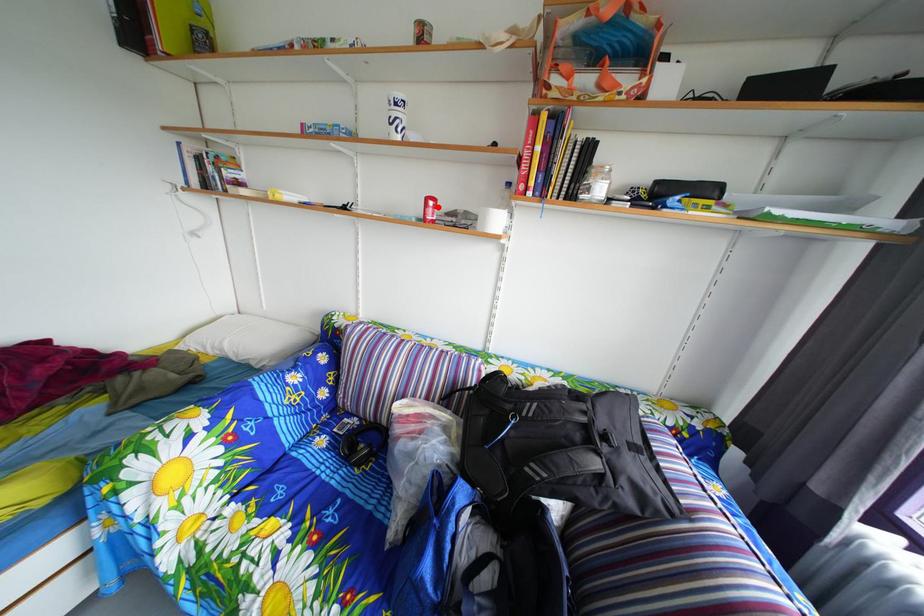
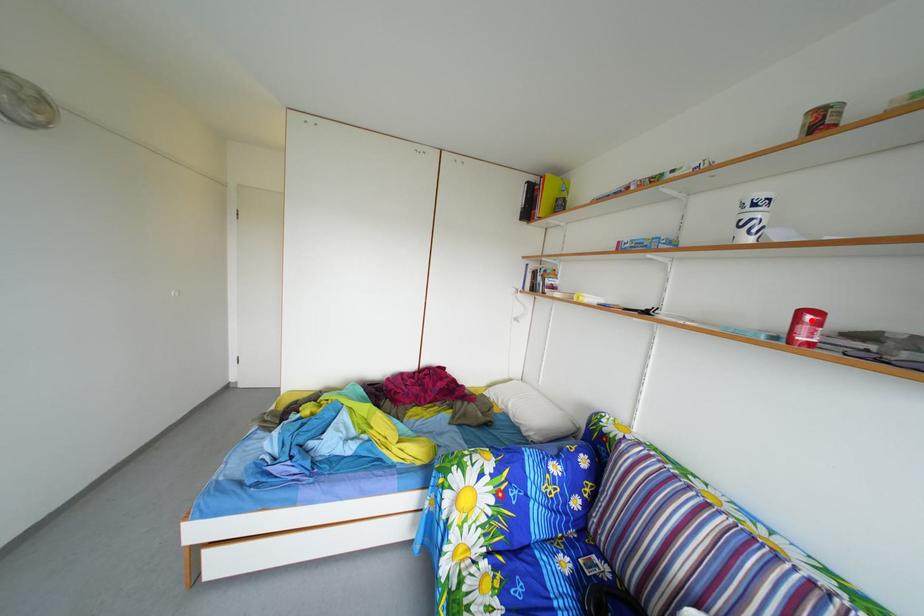
I am providing you with two images of the same scene from different viewpoints. A red point is marked on the first image and another point is marked on the second image. Do the highlighted points in image1 and image2 indicate the same real-world spot?

Yes